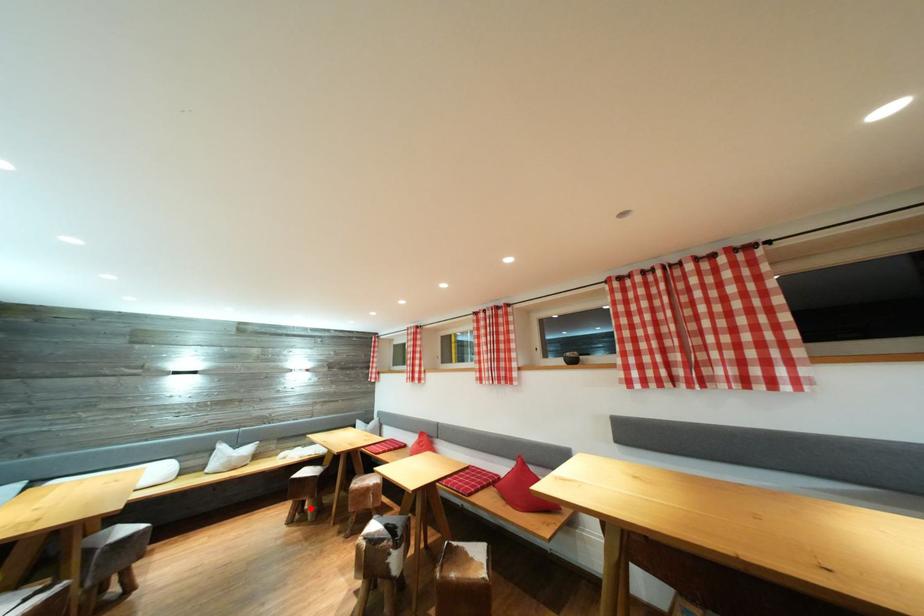
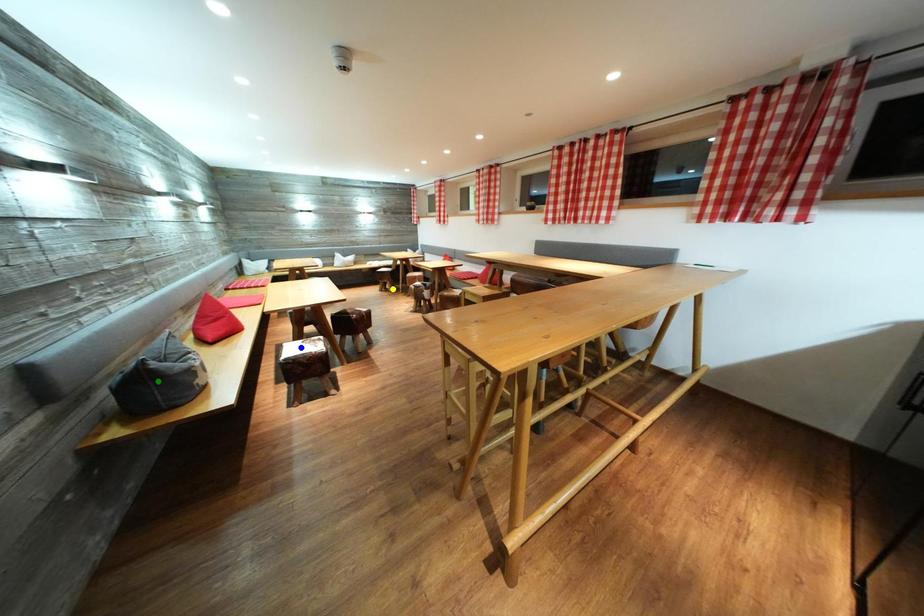
Question: I am providing you with two images of the same scene from different viewpoints. A red point is marked on the first image. You are given multiple points on the second image. Which point in image 2 is actually the same real-world point as the red point in image 1?

Choices:
 (A) yellow point
 (B) blue point
 (C) green point

Answer: (A)